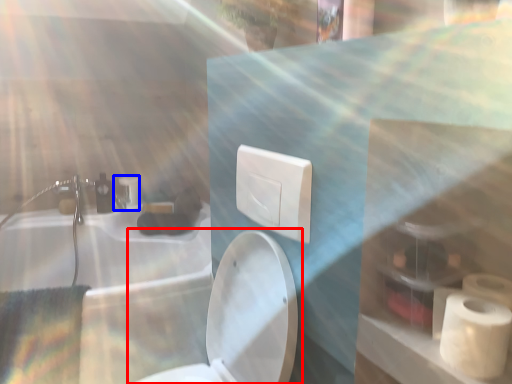
Question: Which object is further to the camera taking this photo, toilet (highlighted by a red box) or faucet (highlighted by a blue box)?

Choices:
 (A) toilet
 (B) faucet

Answer: (B)